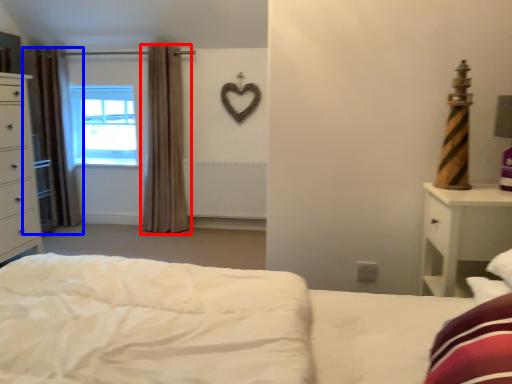
Question: Which object is closer to the camera taking this photo, curtain (highlighted by a red box) or curtain (highlighted by a blue box)?

Choices:
 (A) curtain
 (B) curtain

Answer: (A)